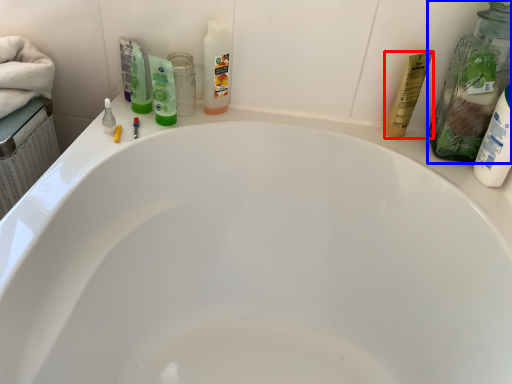
Question: Among these objects, which one is farthest to the camera, toiletry (highlighted by a red box) or cleaning product (highlighted by a blue box)?

Choices:
 (A) toiletry
 (B) cleaning product

Answer: (A)